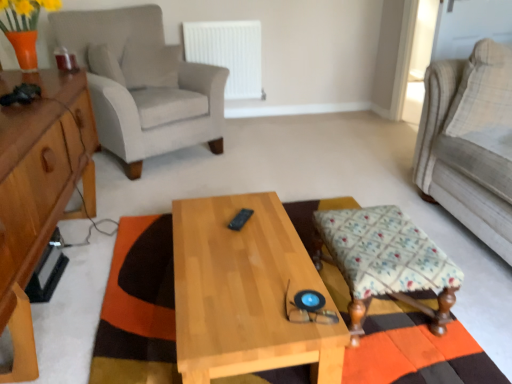
Find the location of a particular element. This screenshot has width=512, height=384. vacant point to the right of floral fabric stool at lower right is located at coordinates (479, 296).